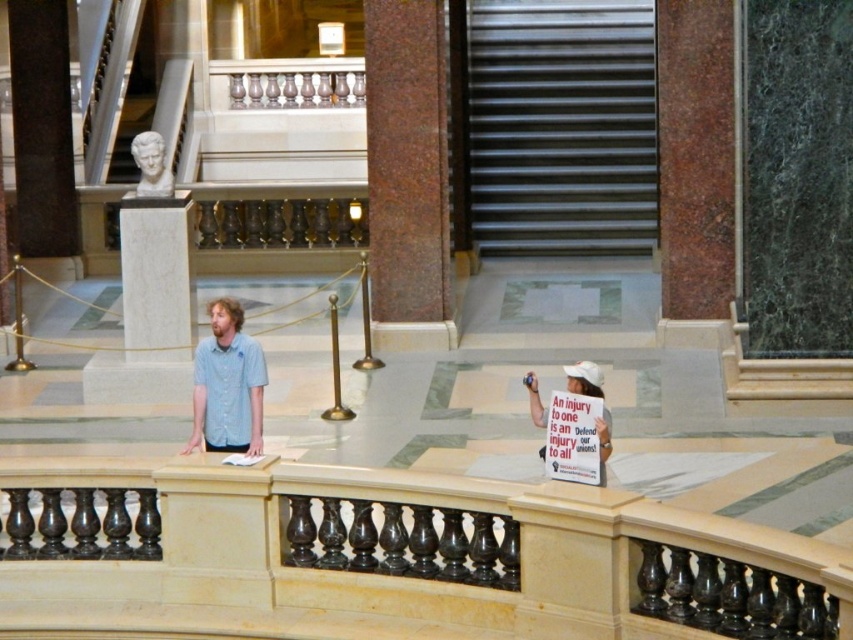
Question: Which of the following is the closest to the observer?

Choices:
 (A) (553, 472)
 (B) (154, 154)
 (C) (566, 371)
 (D) (424, 566)

Answer: (A)

Question: Which of the following is the farthest from the observer?

Choices:
 (A) (387, 93)
 (B) (161, 141)
 (C) (601, 433)

Answer: (A)

Question: Is light blue shirt at center wider than white paper sign at lower right?

Choices:
 (A) no
 (B) yes

Answer: (B)

Question: Is polished stone balustrade at center bigger than white paper sign at lower right?

Choices:
 (A) no
 (B) yes

Answer: (B)

Question: Considering the real-world distances, which object is farthest from the light blue shirt at center?

Choices:
 (A) white marble bust at upper center
 (B) white paper sign at center
 (C) brown polished stone pillar at center

Answer: (C)

Question: Observing the image, what is the correct spatial positioning of polished stone balustrade at center in reference to white paper sign at lower right?

Choices:
 (A) below
 (B) above

Answer: (A)